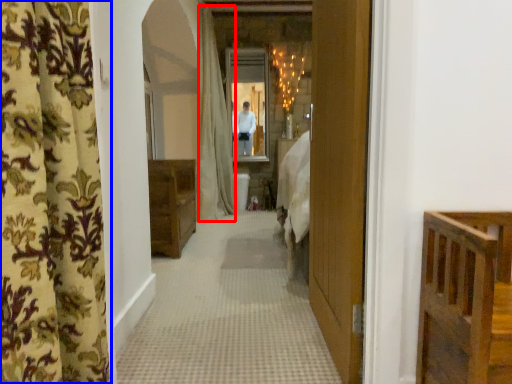
Question: Which point is closer to the camera, shower curtain (highlighted by a red box) or curtain (highlighted by a blue box)?

Choices:
 (A) shower curtain
 (B) curtain

Answer: (B)